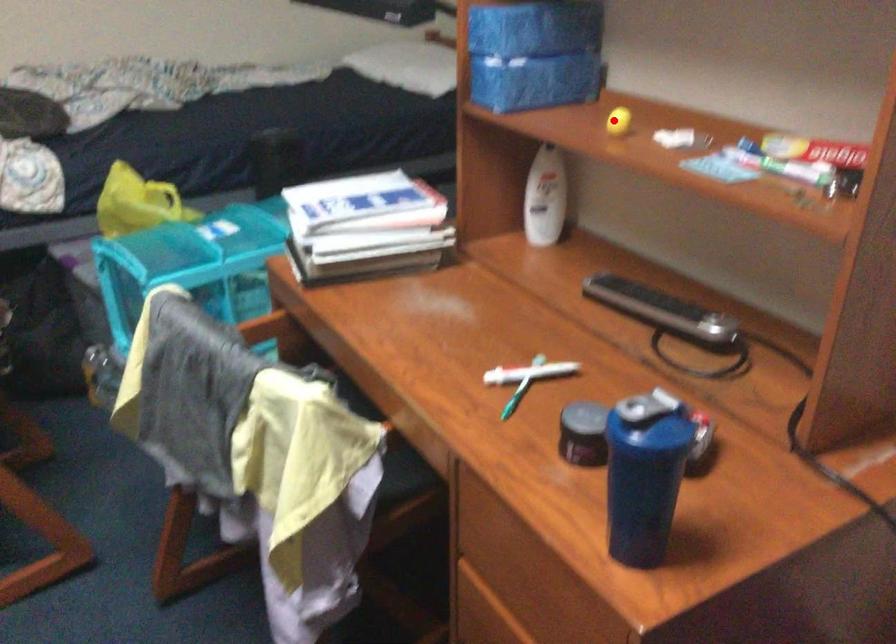
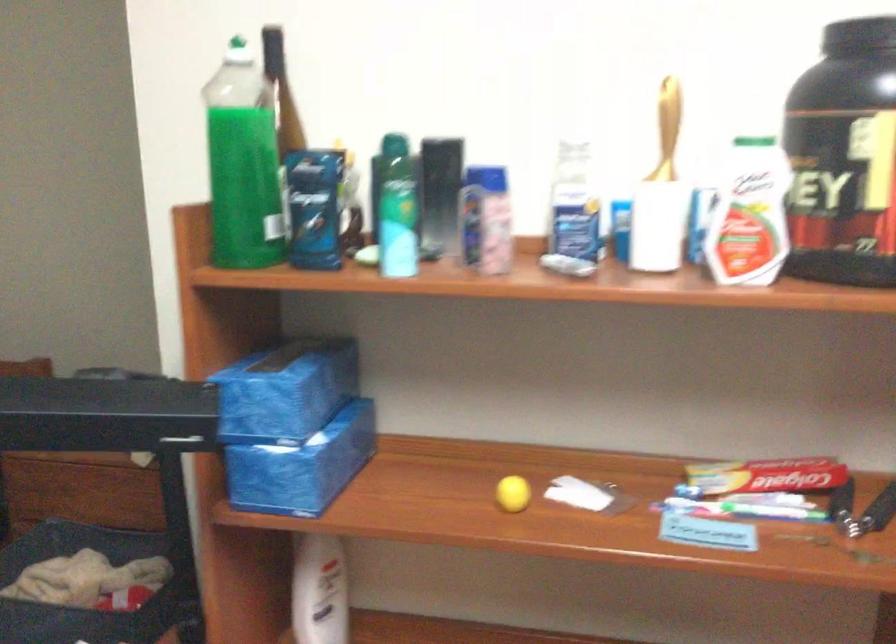
Question: I am providing you with two images of the same scene from different viewpoints. A red point is shown in image1. For the corresponding object point in image2, is it positioned nearer or farther from the camera?

Choices:
 (A) Nearer
 (B) Farther

Answer: (A)